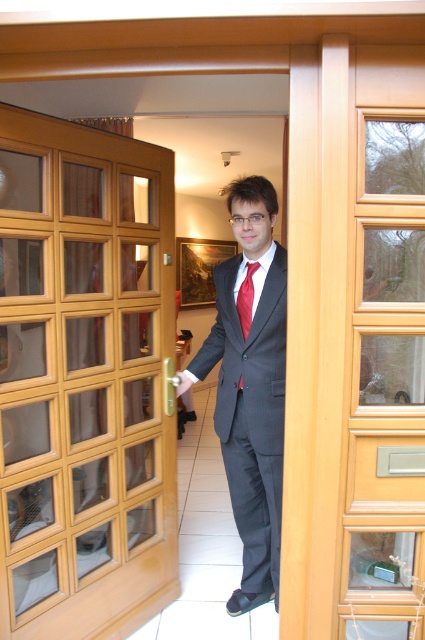
Question: Does wooden glass at left appear under red satin tie at center?

Choices:
 (A) yes
 (B) no

Answer: (A)

Question: Which point is farther to the camera?

Choices:
 (A) red satin tie at center
 (B) wooden glass at left
 (C) dark gray suit at center

Answer: (A)

Question: Which point is closer to the camera?

Choices:
 (A) red satin tie at center
 (B) dark gray suit at center

Answer: (B)

Question: Which of the following is the closest to the observer?

Choices:
 (A) red satin tie at center
 (B) dark gray suit at center
 (C) wooden glass at left

Answer: (C)

Question: Does wooden glass at left appear under dark gray suit at center?

Choices:
 (A) no
 (B) yes

Answer: (A)

Question: Is dark gray suit at center positioned before red satin tie at center?

Choices:
 (A) yes
 (B) no

Answer: (A)